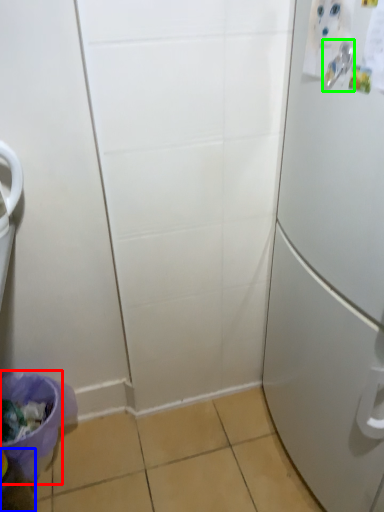
Question: Based on their relative distances, which object is nearer to potty (highlighted by a red box)? Choose from bottle (highlighted by a blue box) and door handle (highlighted by a green box).

Choices:
 (A) bottle
 (B) door handle

Answer: (A)